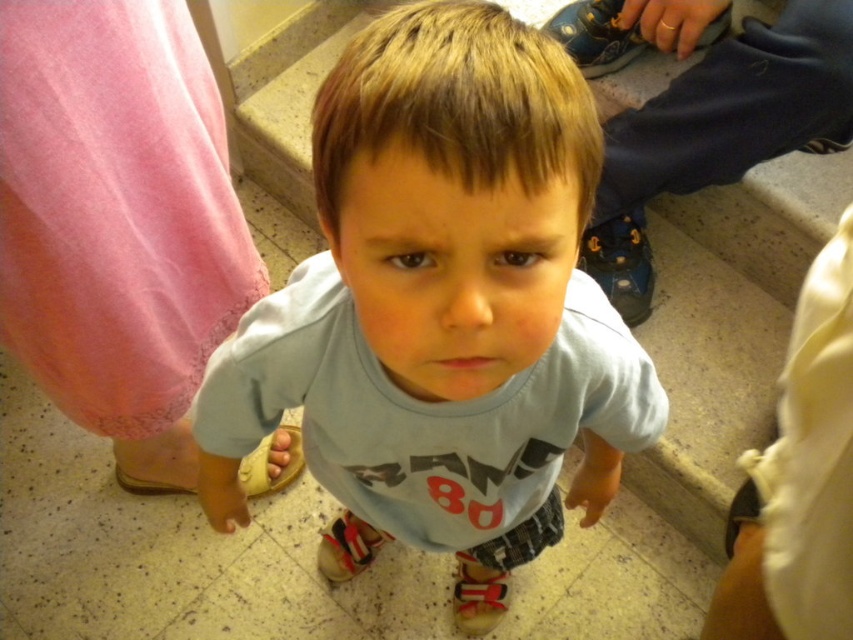
Which of these two, light blue t-shirt at center or tan suede sandal at lower center, stands taller?

light blue t-shirt at center

Who is lower down, light blue t-shirt at center or tan suede sandal at lower center?

Positioned lower is tan suede sandal at lower center.

Which is in front, point (223, 362) or point (283, 433)?

Positioned in front is point (223, 362).

Where is `light blue t-shirt at center`? light blue t-shirt at center is located at coordinates (440, 308).